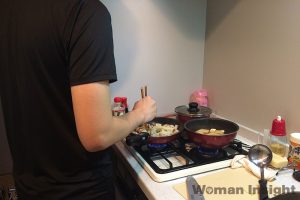
This screenshot has height=200, width=300. In order to click on pot lid in this screenshot , I will do `click(192, 107)`.